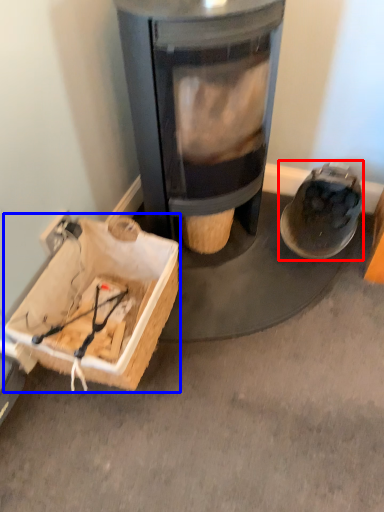
Question: Which point is further to the camera, footwear (highlighted by a red box) or cardboard box (highlighted by a blue box)?

Choices:
 (A) footwear
 (B) cardboard box

Answer: (A)